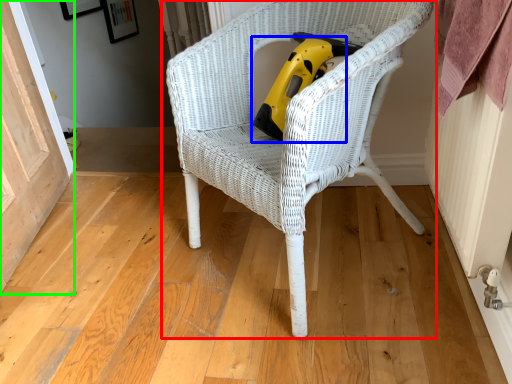
Question: Which object is the closest to the chair (highlighted by a red box)? Choose among these: vacuum (highlighted by a blue box) or screen door (highlighted by a green box).

Choices:
 (A) vacuum
 (B) screen door

Answer: (A)